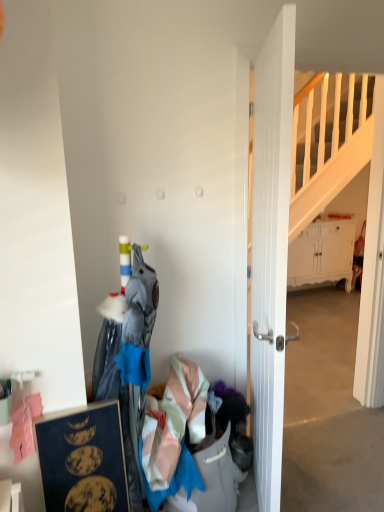
Question: From the image's perspective, does light pink satin dress at lower center appear higher than white matte cabinet at right?

Choices:
 (A) no
 (B) yes

Answer: (A)

Question: Can you confirm if light pink satin dress at lower center is bigger than white matte cabinet at right?

Choices:
 (A) yes
 (B) no

Answer: (B)

Question: Would you say white matte cabinet at right is part of light pink satin dress at lower center's contents?

Choices:
 (A) no
 (B) yes

Answer: (A)

Question: Is light pink satin dress at lower center not near white matte cabinet at right?

Choices:
 (A) yes
 (B) no

Answer: (A)

Question: Can you confirm if light pink satin dress at lower center is taller than white matte cabinet at right?

Choices:
 (A) no
 (B) yes

Answer: (A)

Question: Considering the relative positions of white matte cabinet at right and dark blue matte picture frame at lower left in the image provided, is white matte cabinet at right to the left or to the right of dark blue matte picture frame at lower left?

Choices:
 (A) left
 (B) right

Answer: (B)

Question: Considering the positions of white matte cabinet at right and dark blue matte picture frame at lower left in the image, is white matte cabinet at right wider or thinner than dark blue matte picture frame at lower left?

Choices:
 (A) wide
 (B) thin

Answer: (A)

Question: Is point coord(339,273) positioned closer to the camera than point coord(66,437)?

Choices:
 (A) closer
 (B) farther

Answer: (B)

Question: In terms of height, does white matte cabinet at right look taller or shorter compared to dark blue matte picture frame at lower left?

Choices:
 (A) tall
 (B) short

Answer: (A)

Question: From the image's perspective, is dark blue matte picture frame at lower left located above or below white wooden door at center?

Choices:
 (A) below
 (B) above

Answer: (A)

Question: Relative to white wooden door at center, is dark blue matte picture frame at lower left in front or behind?

Choices:
 (A) behind
 (B) front

Answer: (A)

Question: Considering the positions of dark blue matte picture frame at lower left and white wooden door at center in the image, is dark blue matte picture frame at lower left taller or shorter than white wooden door at center?

Choices:
 (A) tall
 (B) short

Answer: (B)

Question: Do you think dark blue matte picture frame at lower left is within white wooden door at center, or outside of it?

Choices:
 (A) inside
 (B) outside

Answer: (B)

Question: From the image's perspective, is white wooden door at center above or below white matte cabinet at right?

Choices:
 (A) below
 (B) above

Answer: (A)

Question: Does point (271, 486) appear closer or farther from the camera than point (319, 274)?

Choices:
 (A) farther
 (B) closer

Answer: (B)